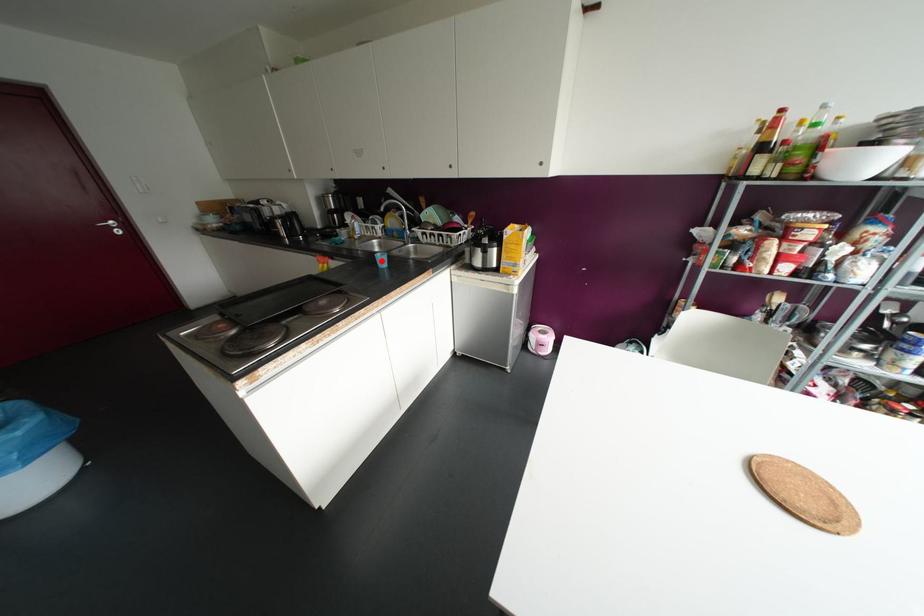
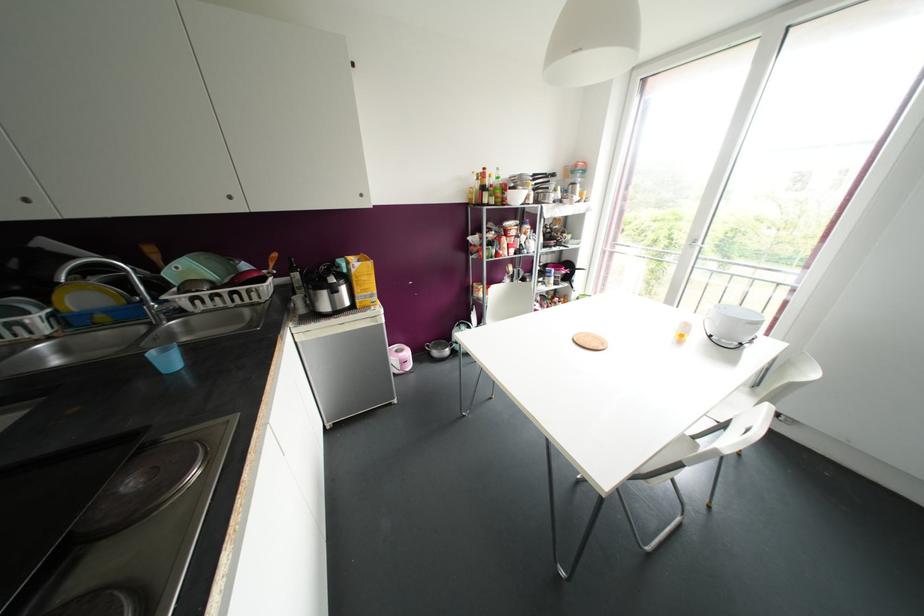
In the second image, find the point that corresponds to the highlighted location in the first image.

(168, 361)